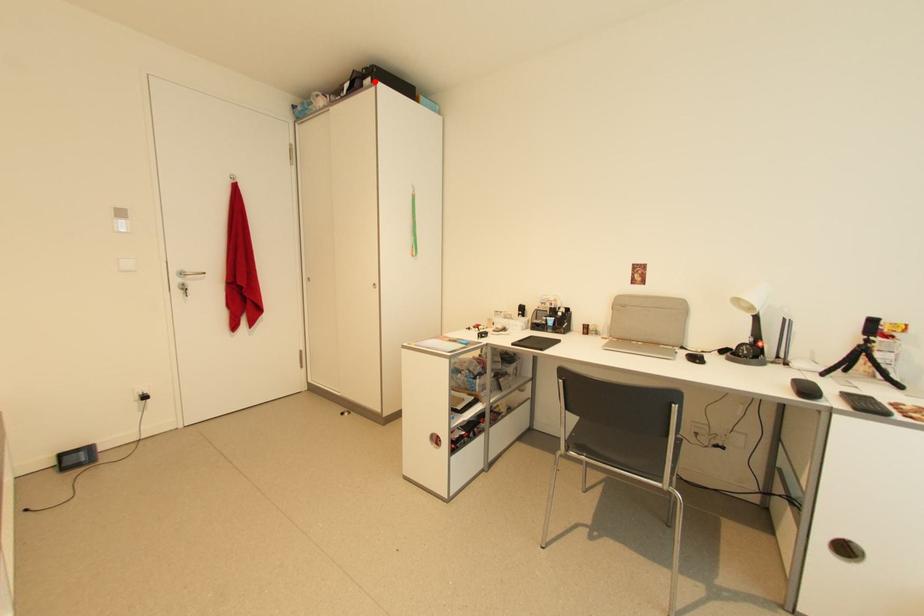
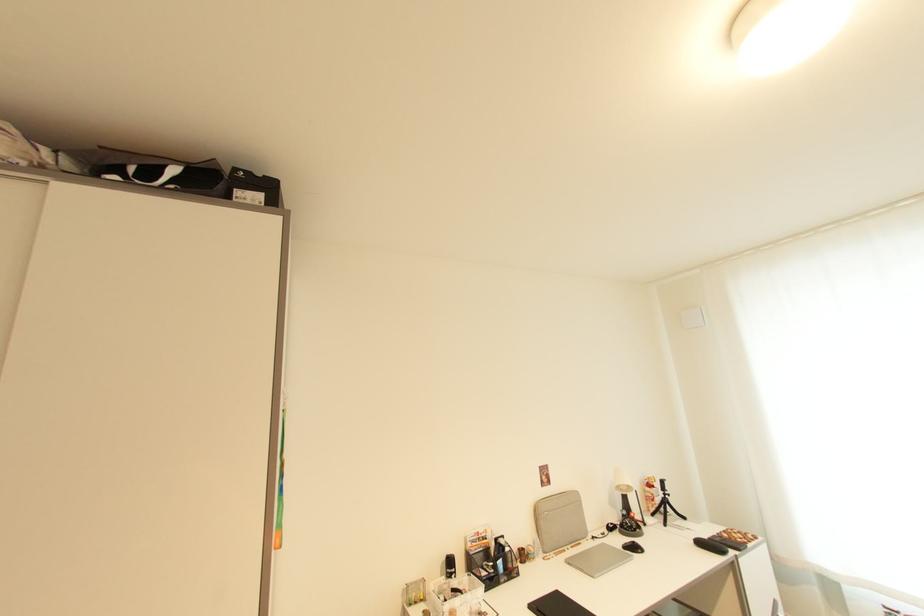
In the second image, find the point that corresponds to the highlighted location in the first image.

(264, 198)